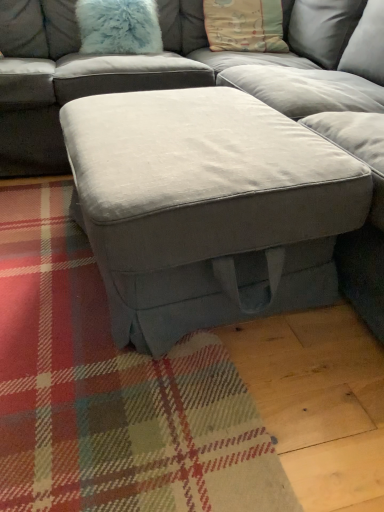
Question: Should I look upward or downward to see pastel cotton pillow at upper center, the second pillow in the left-to-right sequence?

Choices:
 (A) down
 (B) up

Answer: (B)

Question: Considering the relative sizes of fuzzy light blue pillow at upper left, the first pillow viewed from the left, and suede gray ottoman at center in the image provided, is fuzzy light blue pillow at upper left, the first pillow viewed from the left, smaller than suede gray ottoman at center?

Choices:
 (A) yes
 (B) no

Answer: (A)

Question: Is fuzzy light blue pillow at upper left, the first pillow viewed from the left, located outside suede gray ottoman at center?

Choices:
 (A) yes
 (B) no

Answer: (A)

Question: Considering the relative sizes of fuzzy light blue pillow at upper left, the first pillow viewed from the left, and suede gray ottoman at center in the image provided, is fuzzy light blue pillow at upper left, the first pillow viewed from the left, bigger than suede gray ottoman at center?

Choices:
 (A) yes
 (B) no

Answer: (B)

Question: Is the surface of fuzzy light blue pillow at upper left, which ranks as the second pillow in right-to-left order, in direct contact with suede gray ottoman at center?

Choices:
 (A) yes
 (B) no

Answer: (B)

Question: Is fuzzy light blue pillow at upper left, the first pillow viewed from the left, positioned far away from suede gray ottoman at center?

Choices:
 (A) yes
 (B) no

Answer: (B)

Question: Is fuzzy light blue pillow at upper left, the first pillow viewed from the left, at the left side of suede gray ottoman at center?

Choices:
 (A) no
 (B) yes

Answer: (B)

Question: Does pastel cotton pillow at upper center, the second pillow in the left-to-right sequence, have a greater height compared to fuzzy light blue pillow at upper left, which ranks as the second pillow in right-to-left order?

Choices:
 (A) no
 (B) yes

Answer: (B)

Question: Can you confirm if pastel cotton pillow at upper center, the second pillow in the left-to-right sequence, is thinner than fuzzy light blue pillow at upper left, which ranks as the second pillow in right-to-left order?

Choices:
 (A) no
 (B) yes

Answer: (A)

Question: Is pastel cotton pillow at upper center, arranged as the first pillow when viewed from the right, to the right of fuzzy light blue pillow at upper left, which ranks as the second pillow in right-to-left order, from the viewer's perspective?

Choices:
 (A) yes
 (B) no

Answer: (A)

Question: Does pastel cotton pillow at upper center, arranged as the first pillow when viewed from the right, turn towards fuzzy light blue pillow at upper left, the first pillow viewed from the left?

Choices:
 (A) yes
 (B) no

Answer: (B)

Question: Can you confirm if pastel cotton pillow at upper center, the second pillow in the left-to-right sequence, is shorter than fuzzy light blue pillow at upper left, which ranks as the second pillow in right-to-left order?

Choices:
 (A) yes
 (B) no

Answer: (B)

Question: From the image's perspective, is pastel cotton pillow at upper center, arranged as the first pillow when viewed from the right, under fuzzy light blue pillow at upper left, which ranks as the second pillow in right-to-left order?

Choices:
 (A) yes
 (B) no

Answer: (B)

Question: Is suede gray ottoman at center closer to camera compared to fuzzy light blue pillow at upper left, which ranks as the second pillow in right-to-left order?

Choices:
 (A) yes
 (B) no

Answer: (A)